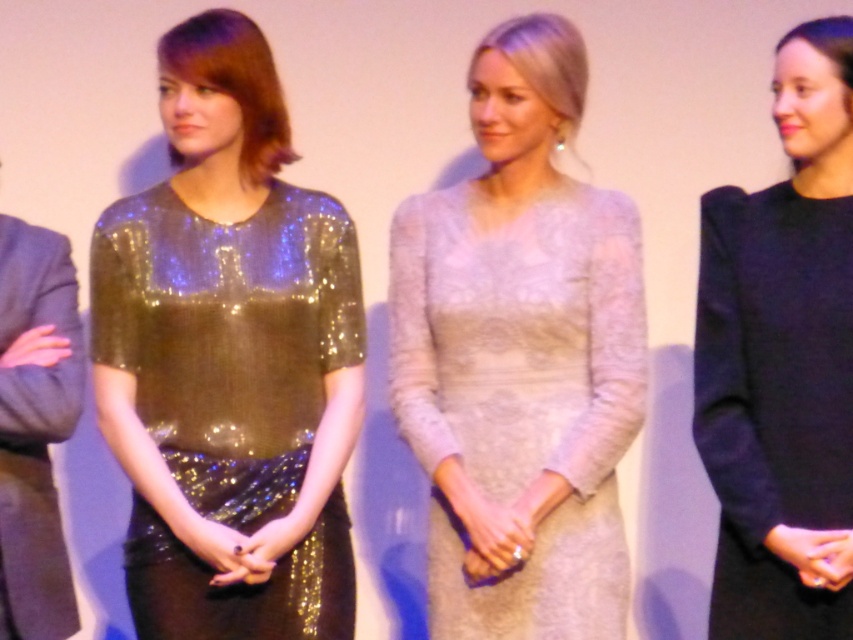
Question: Among these points, which one is nearest to the camera?

Choices:
 (A) (239, 216)
 (B) (570, 554)
 (C) (767, 413)

Answer: (C)

Question: Estimate the real-world distances between objects in this image. Which object is farther from the lace dress at center?

Choices:
 (A) black matte dress at right
 (B) shiny sequined dress at center

Answer: (B)

Question: Can you confirm if shiny sequined dress at center is positioned below black matte dress at right?

Choices:
 (A) no
 (B) yes

Answer: (A)

Question: Does shiny sequined dress at center appear over lace dress at center?

Choices:
 (A) yes
 (B) no

Answer: (B)

Question: Does shiny sequined dress at center have a larger size compared to lace dress at center?

Choices:
 (A) yes
 (B) no

Answer: (B)

Question: Estimate the real-world distances between objects in this image. Which object is farther from the black matte dress at right?

Choices:
 (A) lace dress at center
 (B) shiny sequined dress at center

Answer: (B)